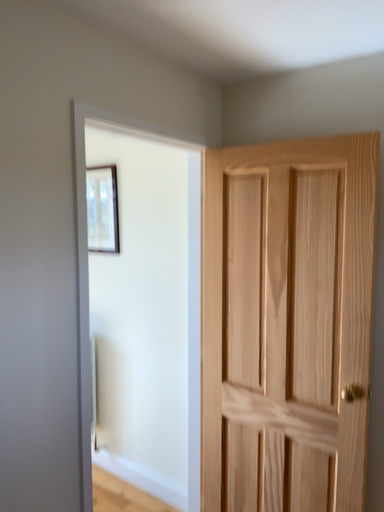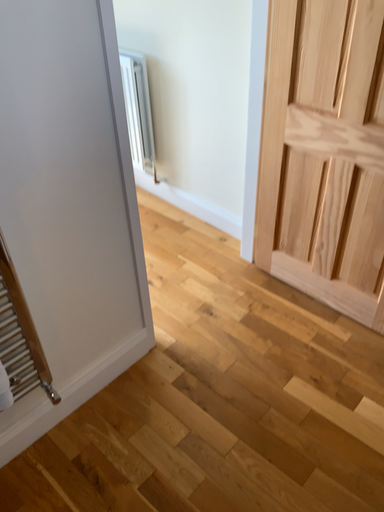
Question: How did the camera likely rotate when shooting the video?

Choices:
 (A) rotated downward
 (B) rotated upward

Answer: (A)